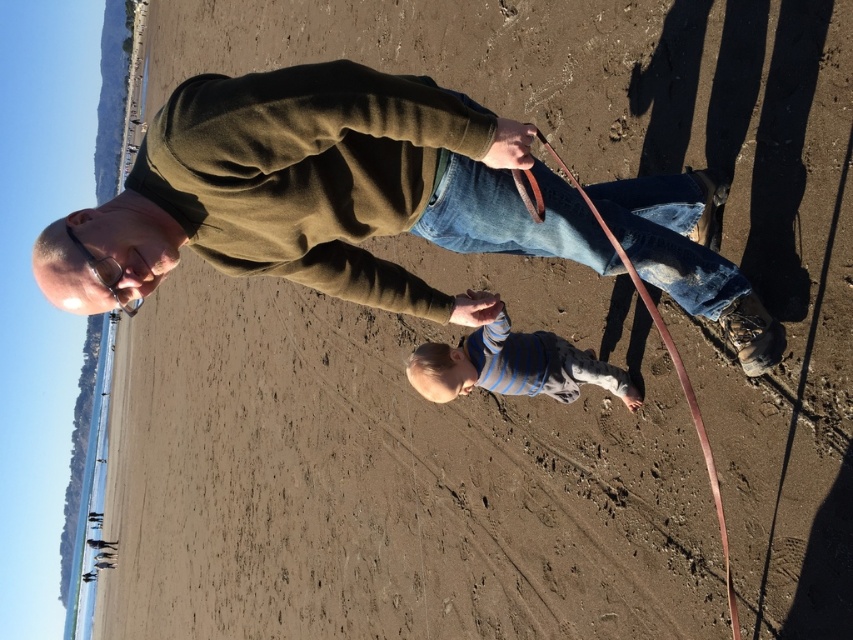
Question: Is matte green sweater at upper center bigger than brown leather leash at lower center?

Choices:
 (A) no
 (B) yes

Answer: (B)

Question: Which point appears farthest from the camera in this image?

Choices:
 (A) (310, 224)
 (B) (496, 385)
 (C) (694, 422)

Answer: (B)

Question: Can you confirm if matte green sweater at upper center is positioned to the left of striped cotton shirt at center?

Choices:
 (A) no
 (B) yes

Answer: (B)

Question: In this image, where is matte green sweater at upper center located relative to striped cotton shirt at center?

Choices:
 (A) below
 (B) above

Answer: (B)

Question: Which point is closer to the camera?

Choices:
 (A) striped cotton shirt at center
 (B) brown leather leash at lower center
 (C) matte green sweater at upper center

Answer: (C)

Question: Which of the following is the farthest from the observer?

Choices:
 (A) brown leather leash at lower center
 (B) striped cotton shirt at center

Answer: (B)